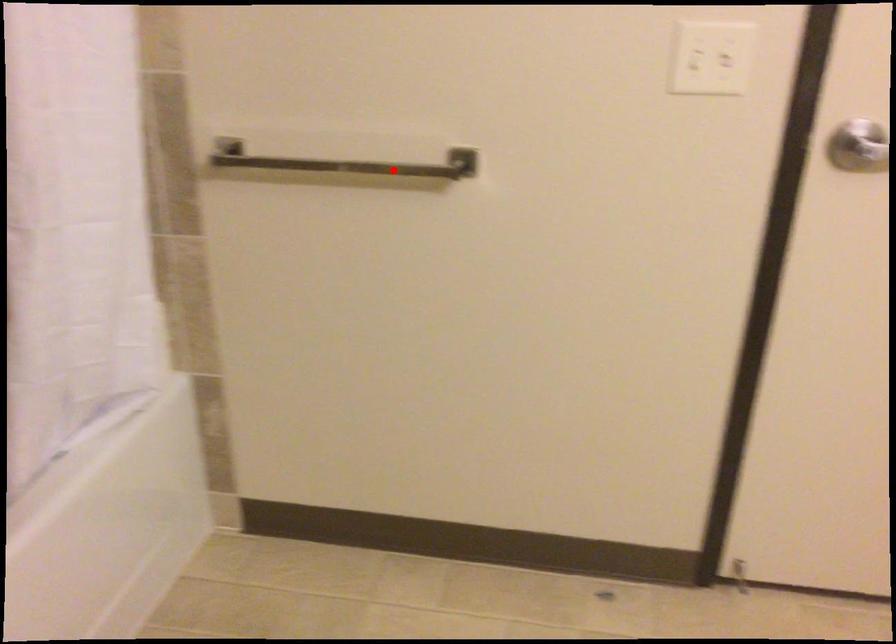
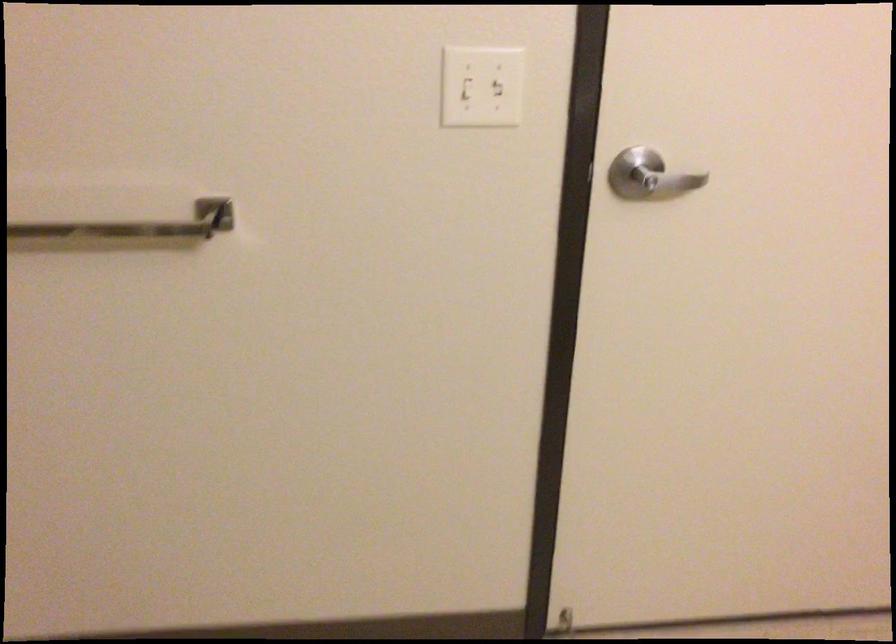
The point at the highlighted location is marked in the first image. Where is the corresponding point in the second image?

(135, 225)